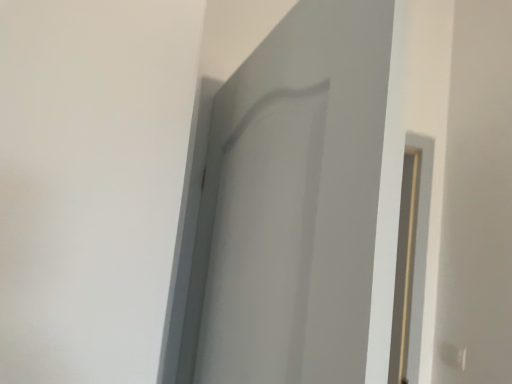
In order to face white matte door at center, should I rotate leftwards or rightwards?

You should rotate left by 3.042 degrees.

Measure the distance between white matte door at center and camera.

The distance of white matte door at center from camera is 17.21 inches.

The width and height of the screenshot is (512, 384). What do you see at coordinates (296, 207) in the screenshot?
I see `white matte door at center` at bounding box center [296, 207].

This screenshot has height=384, width=512. I want to click on white matte door at center, so click(296, 207).

What are the coordinates of `white matte door at center` in the screenshot? It's located at (296, 207).